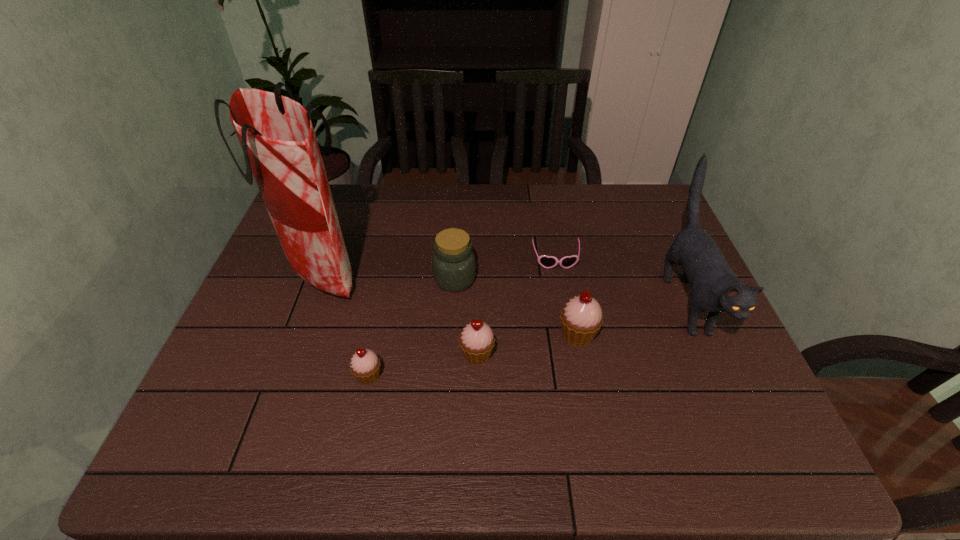
Locate an element on the screen. This screenshot has width=960, height=540. the shortest cupcake is located at coordinates (365, 365).

Image resolution: width=960 pixels, height=540 pixels. In order to click on the leftmost cupcake in this screenshot , I will do `click(365, 365)`.

Locate an element on the screen. the second cupcake from left to right is located at coordinates (476, 340).

Where is `the fifth tallest object`? The image size is (960, 540). the fifth tallest object is located at coordinates (476, 340).

The image size is (960, 540). What are the coordinates of `the tallest cupcake` in the screenshot? It's located at (581, 318).

The image size is (960, 540). What are the coordinates of `the rightmost object` in the screenshot? It's located at (716, 289).

Image resolution: width=960 pixels, height=540 pixels. I want to click on the sixth shortest object, so click(716, 289).

Find the location of a particular element. The width and height of the screenshot is (960, 540). jar is located at coordinates (453, 264).

Find the location of a particular element. the leftmost object is located at coordinates pos(280,147).

At what (x,y) coordinates should I click in order to perform the action: click on grocery bag. Please return your answer as a coordinate pair (x, y). Looking at the image, I should click on (280, 147).